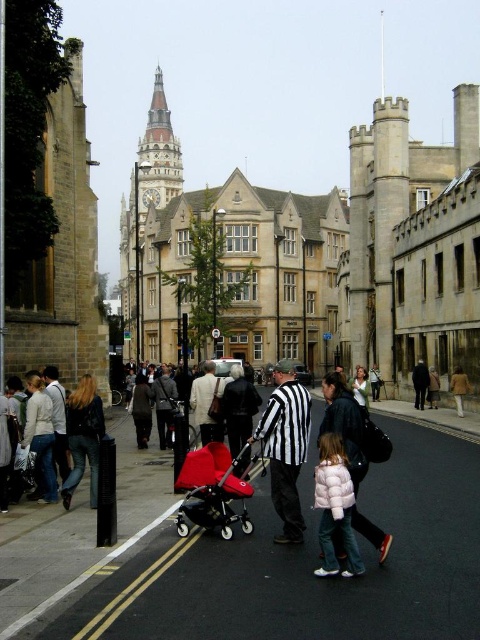
Question: Observing the image, what is the correct spatial positioning of black and white striped shirt at center in reference to matte red baby carriage at center?

Choices:
 (A) above
 (B) below

Answer: (A)

Question: Is black and white striped shirt at center bigger than white puffy coat at lower center?

Choices:
 (A) yes
 (B) no

Answer: (A)

Question: Which is farther from the white puffy coat at lower center?

Choices:
 (A) black and white striped shirt at center
 (B) smooth concrete pavement at center
 (C) matte red baby carriage at center

Answer: (B)

Question: Which point is farther from the camera taking this photo?

Choices:
 (A) (343, 544)
 (B) (224, 484)

Answer: (B)

Question: Is smooth concrete pavement at center positioned in front of white puffy coat at lower center?

Choices:
 (A) no
 (B) yes

Answer: (B)

Question: Which point is closer to the camera taking this photo?

Choices:
 (A) (335, 449)
 (B) (182, 620)
 (C) (203, 480)
 (D) (277, 460)

Answer: (B)